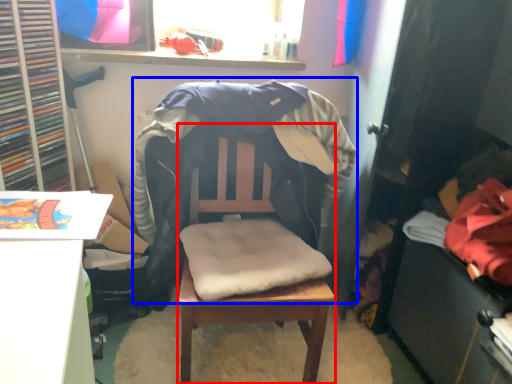
Question: Among these objects, which one is farthest to the camera, chair (highlighted by a red box) or bean bag chair (highlighted by a blue box)?

Choices:
 (A) chair
 (B) bean bag chair

Answer: (B)